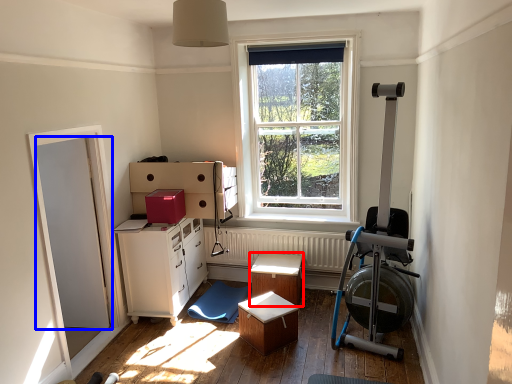
Question: Which of the following is the farthest to the observer, table (highlighted by a red box) or door (highlighted by a blue box)?

Choices:
 (A) table
 (B) door

Answer: (A)